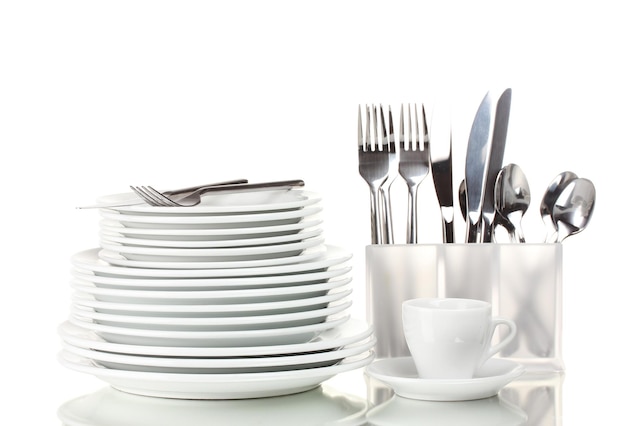
The height and width of the screenshot is (426, 626). I want to click on forks, so click(x=190, y=195), click(x=367, y=164), click(x=391, y=160), click(x=411, y=163).